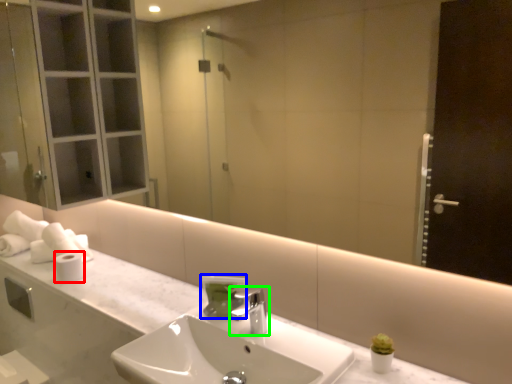
Question: Based on their relative distances, which object is nearer to toilet paper (highlighted by a red box)? Choose from soap dispenser (highlighted by a blue box) and tap (highlighted by a green box).

Choices:
 (A) soap dispenser
 (B) tap

Answer: (A)